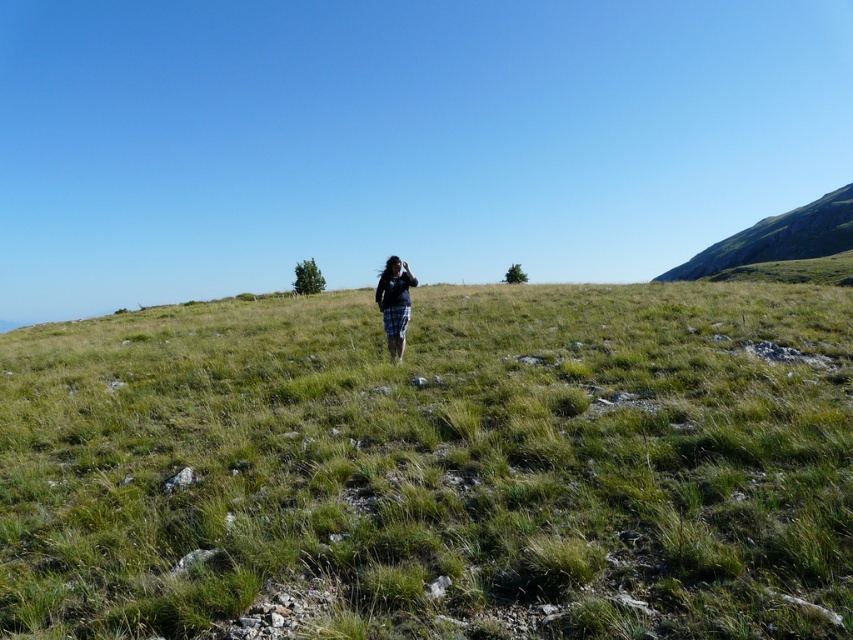
Is green grassy hillside at upper right taller than plaid skirt at center?

Indeed, green grassy hillside at upper right has a greater height compared to plaid skirt at center.

Is green grassy hillside at upper right above plaid skirt at center?

Correct, green grassy hillside at upper right is located above plaid skirt at center.

Is point (701, 268) farther from camera compared to point (381, 285)?

Yes, it is.

In order to click on green grassy hillside at upper right in this screenshot , I will do `click(778, 237)`.

This screenshot has width=853, height=640. What do you see at coordinates (434, 467) in the screenshot? I see `green grassy at center` at bounding box center [434, 467].

Can you confirm if green grassy at center is bigger than plaid skirt at center?

Yes, green grassy at center is bigger than plaid skirt at center.

Who is more distant from viewer, (167, 598) or (390, 339)?

Positioned behind is point (390, 339).

Where is `green grassy at center`? green grassy at center is located at coordinates (434, 467).

From the picture: Can you confirm if green grassy at center is positioned above green grassy hillside at upper right?

Actually, green grassy at center is below green grassy hillside at upper right.

Does green grassy at center appear on the left side of green grassy hillside at upper right?

Yes, green grassy at center is to the left of green grassy hillside at upper right.

Which is in front, point (709, 621) or point (836, 250)?

Point (709, 621) is in front.

At what (x,y) coordinates should I click in order to perform the action: click on green grassy at center. Please return your answer as a coordinate pair (x, y). This screenshot has height=640, width=853. Looking at the image, I should click on (434, 467).